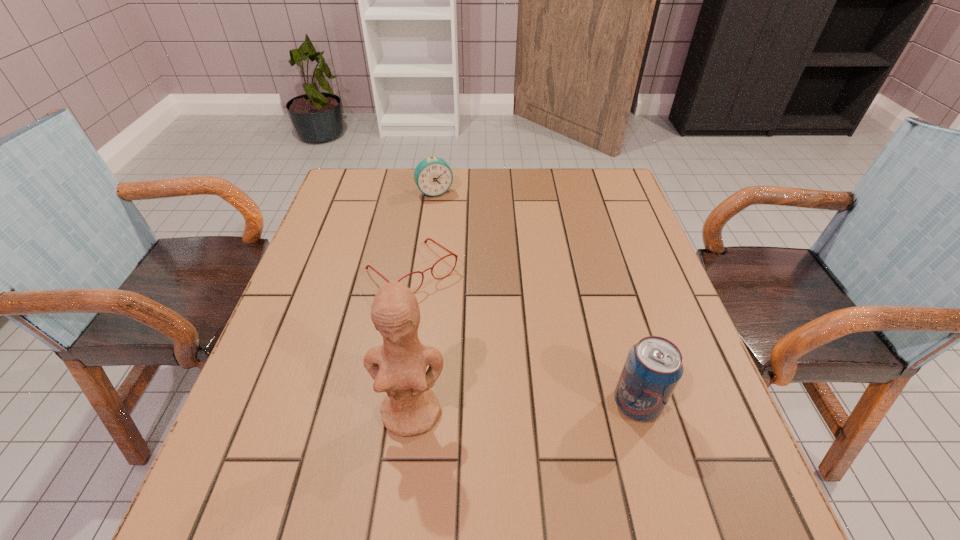
This screenshot has width=960, height=540. In order to click on free spot between the spectacles and the second tallest object in this screenshot , I will do `click(524, 337)`.

You are a GUI agent. You are given a task and a screenshot of the screen. Output one action in this format:
    pyautogui.click(x=<x>, y=<y>)
    Task: Click on the free point between the second tallest object and the farthest object
    Image resolution: width=960 pixels, height=540 pixels.
    Given the screenshot: What is the action you would take?
    pyautogui.click(x=536, y=298)

Find the location of a particular element. blank region between the pop soda and the shortest object is located at coordinates (524, 337).

This screenshot has height=540, width=960. I want to click on free point between the farthest object and the shortest object, so click(423, 232).

Where is `blank region between the alarm clock and the second farthest object`? blank region between the alarm clock and the second farthest object is located at coordinates coord(423,232).

What are the coordinates of `empty location between the farthest object and the spectacles` in the screenshot? It's located at (423, 232).

This screenshot has height=540, width=960. I want to click on the closest object relative to the figurine, so click(x=425, y=241).

Locate which object ranks third in proximity to the second tallest object. Please provide its 2D coordinates. Your answer should be formatted as a tuple, i.e. [(x, y)], where the tuple contains the x and y coordinates of a point satisfying the conditions above.

[(433, 176)]

This screenshot has width=960, height=540. I want to click on vacant space that satisfies the following two spatial constraints: 1. on the back side of the spectacles; 2. on the left side of the alarm clock, so click(x=424, y=192).